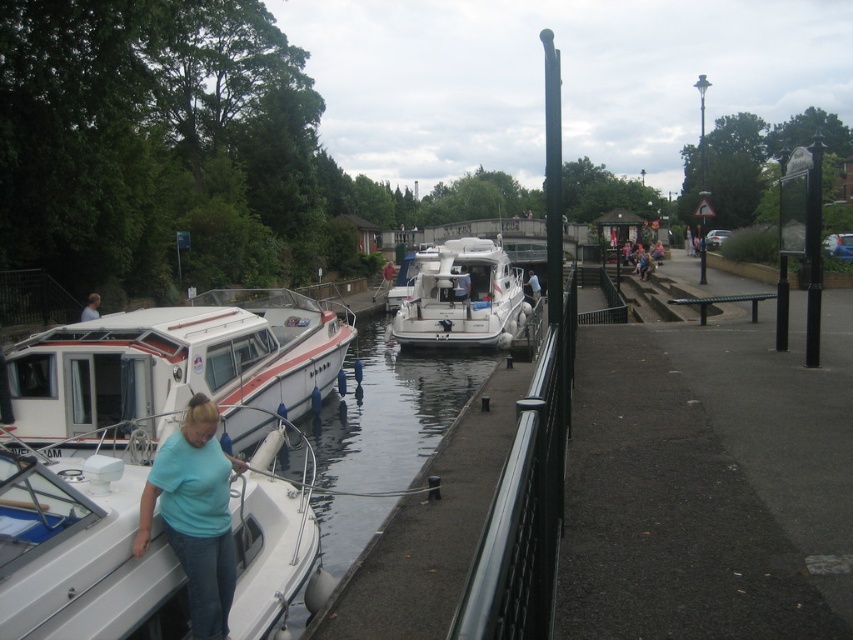
You are standing on the dock and want to reach a specific point marked at coordinates point [264,496]. If your current position is 10 feet away from that point, how much farther do you need to walk to reach it?

The distance of point [264,496] from viewer is 21.87 feet. Since you are already 10 feet away from it, you need to walk an additional 11.87 feet to reach the point.

From the picture: You are standing at the point labeled as point (82,552) in the image. What object are you closest to?

The point (82,552) corresponds to the white glossy boat at lower left, so you are closest to the white glossy boat at lower left.

You are standing on the dock and see both the white glossy boat at lower left and the white glossy boat at left. Which boat is positioned closer to the water surface?

The white glossy boat at lower left is positioned closer to the water surface because it is located below the white glossy boat at left.